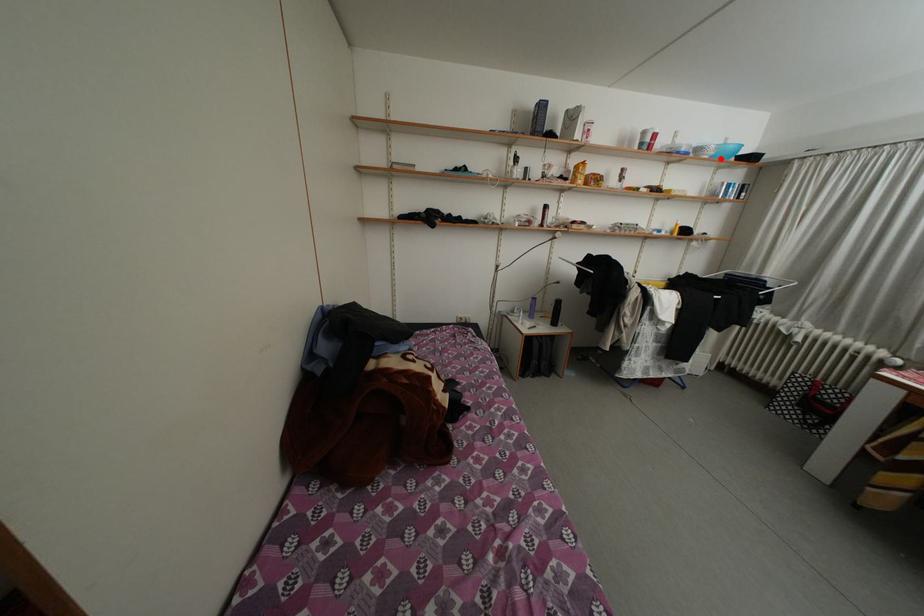
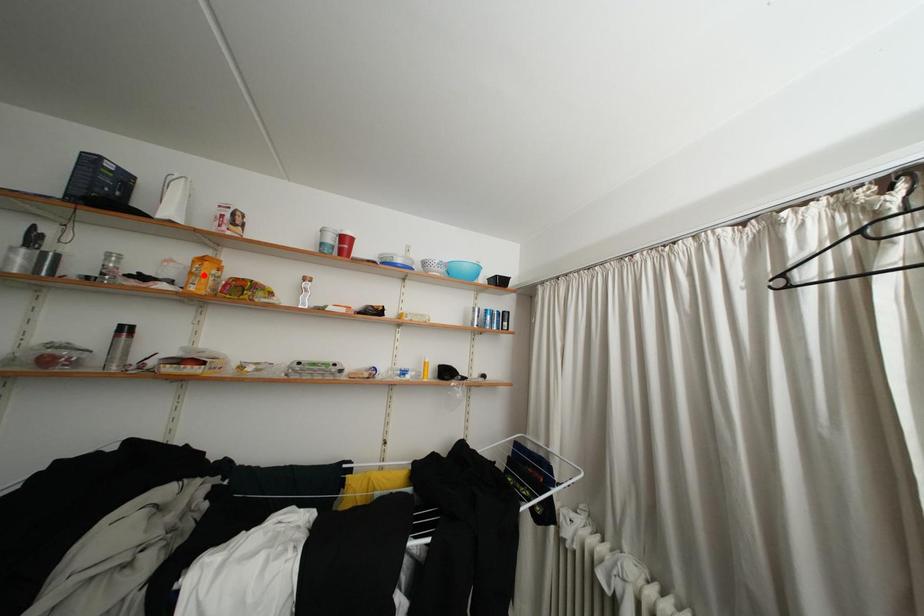
I am providing you with two images of the same scene from different viewpoints. A red point is marked on the first image and another point is marked on the second image. Is the red point in image1 aligned with the point shown in image2?

No